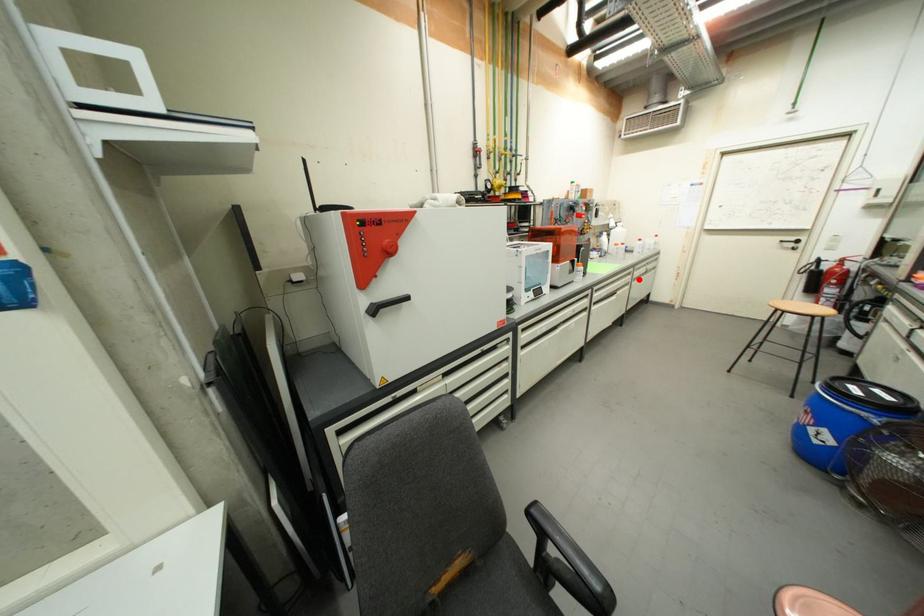
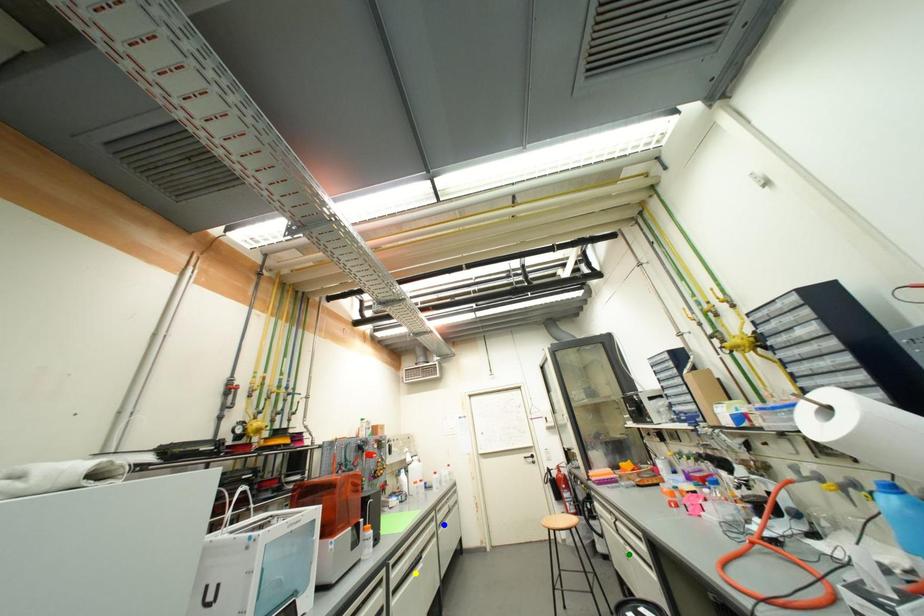
Question: I am providing you with two images of the same scene from different viewpoints. A red point is marked on the first image. You are given multiple points on the second image. Which mark in image 2 goes with the point in image 1?

Choices:
 (A) blue point
 (B) green point
 (C) yellow point

Answer: (A)